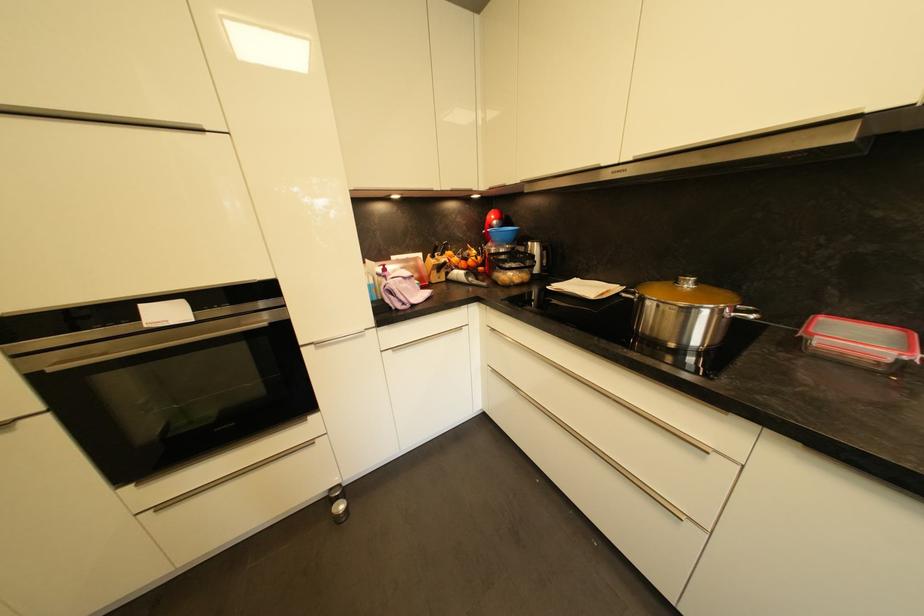
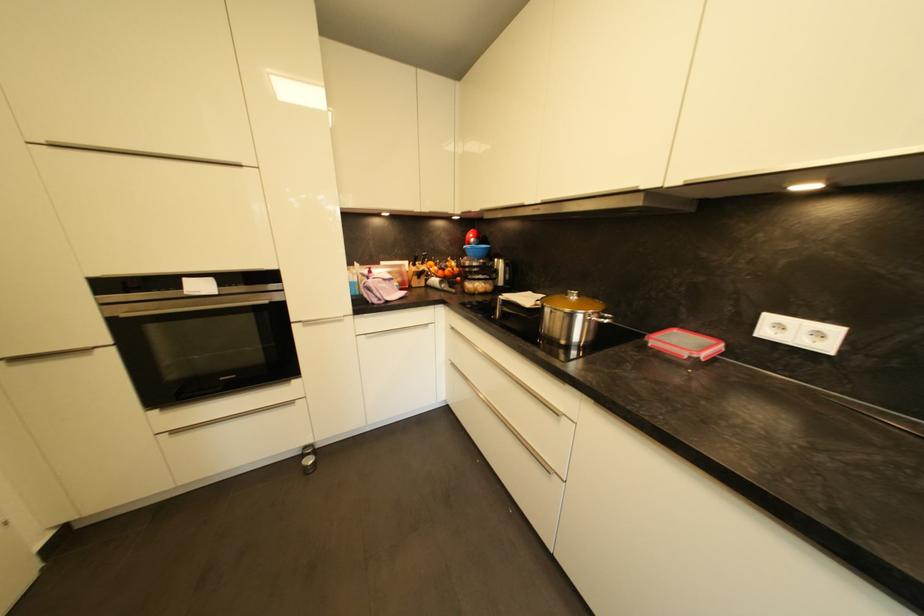
Where in the second image is the point corresponding to (861,339) from the first image?

(686, 345)